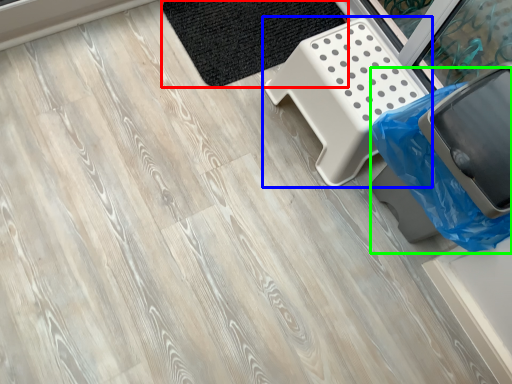
Question: Based on their relative distances, which object is nearer to mat (highlighted by a red box)? Choose from furniture (highlighted by a blue box) and garbage (highlighted by a green box).

Choices:
 (A) furniture
 (B) garbage

Answer: (A)